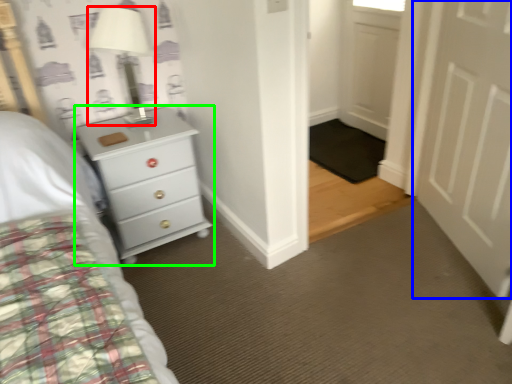
Question: Which object is the farthest from lamp (highlighted by a red box)? Choose among these: door (highlighted by a blue box) or chest of drawers (highlighted by a green box).

Choices:
 (A) door
 (B) chest of drawers

Answer: (A)